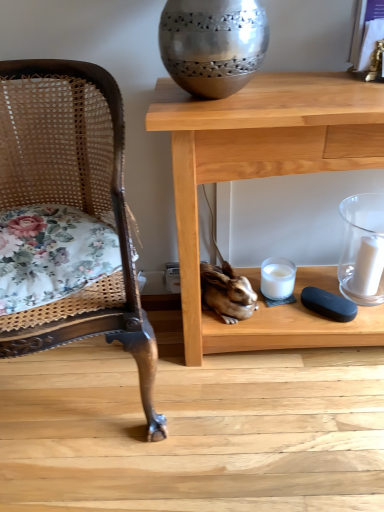
Question: Is woven cane chair at left at the back of white glass candle at lower center, marked as the first candle holder in a left-to-right arrangement?

Choices:
 (A) no
 (B) yes

Answer: (A)

Question: Can you confirm if white glass candle at lower center, marked as the first candle holder in a left-to-right arrangement, is smaller than woven cane chair at left?

Choices:
 (A) no
 (B) yes

Answer: (B)

Question: From a real-world perspective, is white glass candle at lower center, marked as the first candle holder in a left-to-right arrangement, under woven cane chair at left?

Choices:
 (A) yes
 (B) no

Answer: (A)

Question: From a real-world perspective, is white glass candle at lower center, marked as the first candle holder in a left-to-right arrangement, physically above woven cane chair at left?

Choices:
 (A) no
 (B) yes

Answer: (A)

Question: Is white glass candle at lower center, marked as the first candle holder in a left-to-right arrangement, wider than woven cane chair at left?

Choices:
 (A) no
 (B) yes

Answer: (A)

Question: Can you confirm if white glass candle at lower center, which ranks as the 2th candle holder in right-to-left order, is positioned to the left of woven cane chair at left?

Choices:
 (A) no
 (B) yes

Answer: (A)

Question: Does woven cane chair at left turn towards white glass candle at lower center, which ranks as the 2th candle holder in right-to-left order?

Choices:
 (A) no
 (B) yes

Answer: (A)

Question: From a real-world perspective, is woven cane chair at left positioned under white glass candle at lower center, marked as the first candle holder in a left-to-right arrangement, based on gravity?

Choices:
 (A) no
 (B) yes

Answer: (A)

Question: Considering the relative sizes of woven cane chair at left and white glass candle at lower center, marked as the first candle holder in a left-to-right arrangement, in the image provided, is woven cane chair at left bigger than white glass candle at lower center, marked as the first candle holder in a left-to-right arrangement,?

Choices:
 (A) no
 (B) yes

Answer: (B)

Question: From the image's perspective, is woven cane chair at left located beneath white glass candle at lower center, which ranks as the 2th candle holder in right-to-left order?

Choices:
 (A) yes
 (B) no

Answer: (B)

Question: Does woven cane chair at left have a greater height compared to white glass candle at lower center, marked as the first candle holder in a left-to-right arrangement?

Choices:
 (A) yes
 (B) no

Answer: (A)

Question: Does woven cane chair at left have a smaller size compared to white glass candle at lower center, which ranks as the 2th candle holder in right-to-left order?

Choices:
 (A) yes
 (B) no

Answer: (B)

Question: Is white matte candle at right far from woven cane chair at left?

Choices:
 (A) yes
 (B) no

Answer: (B)